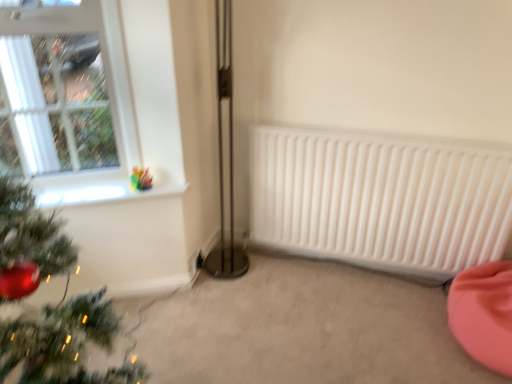
Question: Would you consider translucent glass vase at upper left to be distant from white glass window at upper left?

Choices:
 (A) no
 (B) yes

Answer: (B)

Question: Considering the relative sizes of translucent glass vase at upper left and white glass window at upper left in the image provided, is translucent glass vase at upper left bigger than white glass window at upper left?

Choices:
 (A) yes
 (B) no

Answer: (B)

Question: From the image's perspective, is translucent glass vase at upper left under white glass window at upper left?

Choices:
 (A) yes
 (B) no

Answer: (A)

Question: Can white glass window at upper left be found inside translucent glass vase at upper left?

Choices:
 (A) yes
 (B) no

Answer: (B)

Question: Is translucent glass vase at upper left smaller than white glass window at upper left?

Choices:
 (A) no
 (B) yes

Answer: (B)

Question: Is translucent glass vase at upper left to the left of white glass window at upper left from the viewer's perspective?

Choices:
 (A) no
 (B) yes

Answer: (A)

Question: Is white glass window at upper left in contact with translucent glass vase at upper left?

Choices:
 (A) no
 (B) yes

Answer: (A)

Question: From a real-world perspective, is white glass window at upper left positioned over translucent glass vase at upper left based on gravity?

Choices:
 (A) yes
 (B) no

Answer: (A)

Question: Is white glass window at upper left positioned beyond the bounds of translucent glass vase at upper left?

Choices:
 (A) no
 (B) yes

Answer: (B)

Question: Is white glass window at upper left not near translucent glass vase at upper left?

Choices:
 (A) no
 (B) yes

Answer: (B)

Question: Considering the relative sizes of white glass window at upper left and translucent glass vase at upper left in the image provided, is white glass window at upper left taller than translucent glass vase at upper left?

Choices:
 (A) yes
 (B) no

Answer: (A)

Question: Can you confirm if white glass window at upper left is shorter than translucent glass vase at upper left?

Choices:
 (A) no
 (B) yes

Answer: (A)

Question: Can we say translucent glass vase at upper left lies outside pink fabric bean bag at lower right?

Choices:
 (A) yes
 (B) no

Answer: (A)